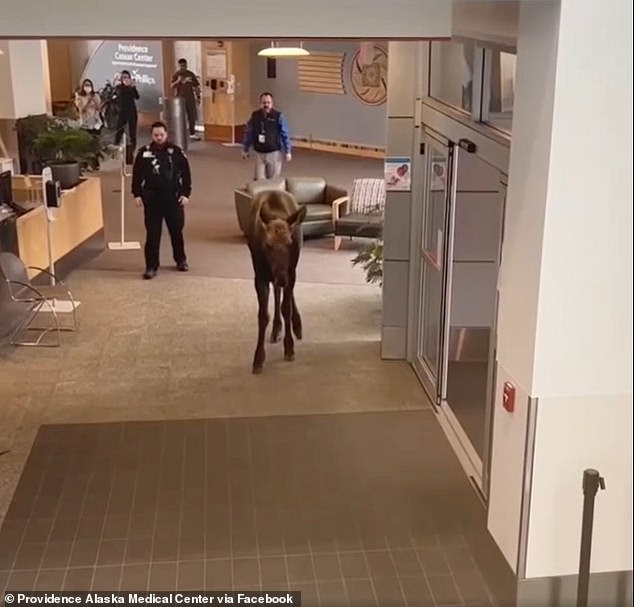
I want to click on the front desk, so click(x=67, y=202).